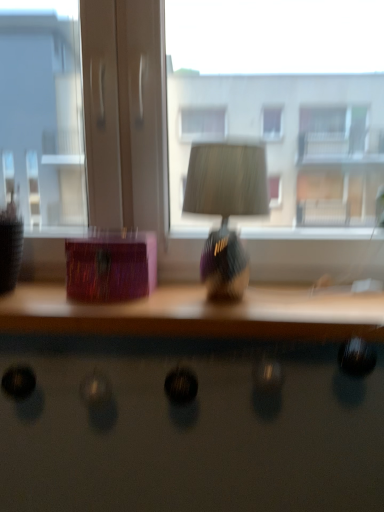
Locate an element on the screen. empty space that is ontop of wooden table at center (from a real-world perspective) is located at coordinates (173, 293).